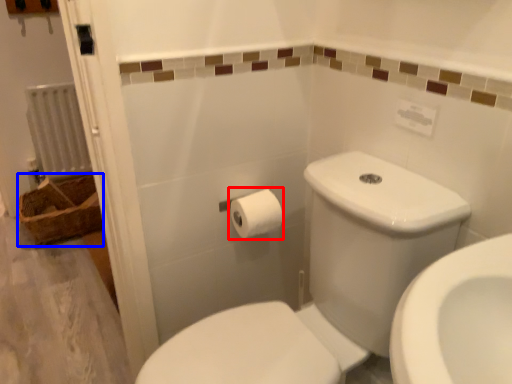
Question: Which object is further to the camera taking this photo, toilet paper (highlighted by a red box) or basket (highlighted by a blue box)?

Choices:
 (A) toilet paper
 (B) basket

Answer: (B)